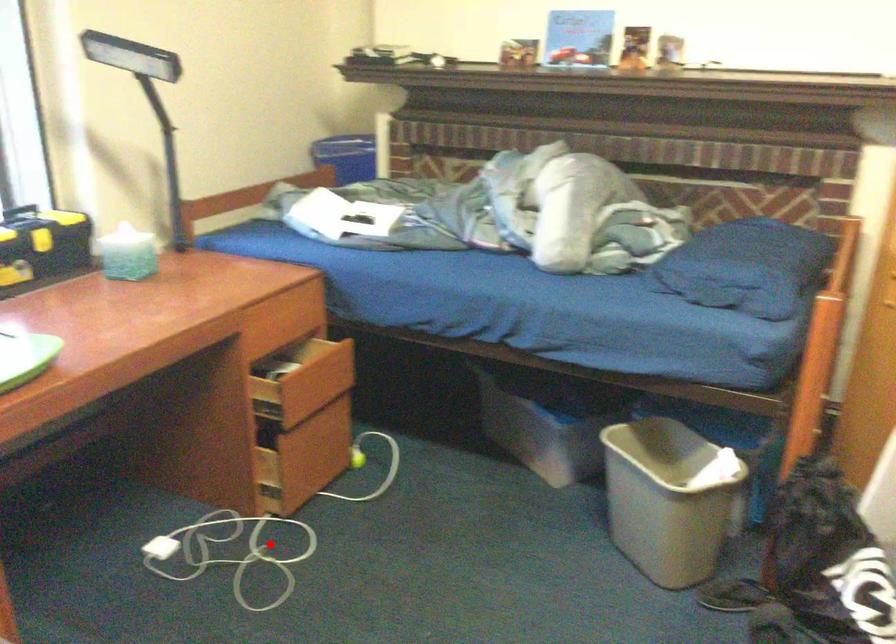
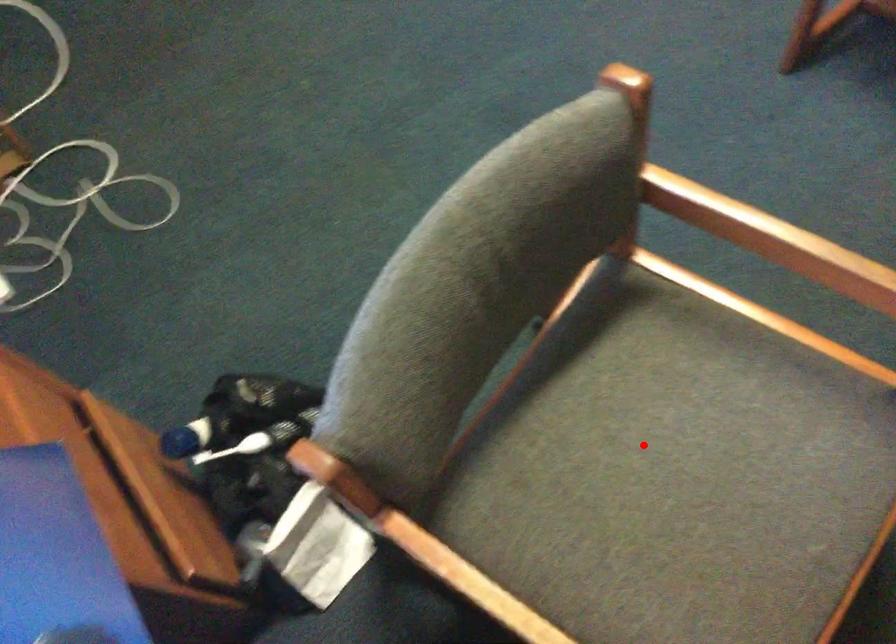
I am providing you with two images of the same scene from different viewpoints. A red point is marked on the first image and another point is marked on the second image. Does the point marked in image1 correspond to the same location as the one in image2?

No